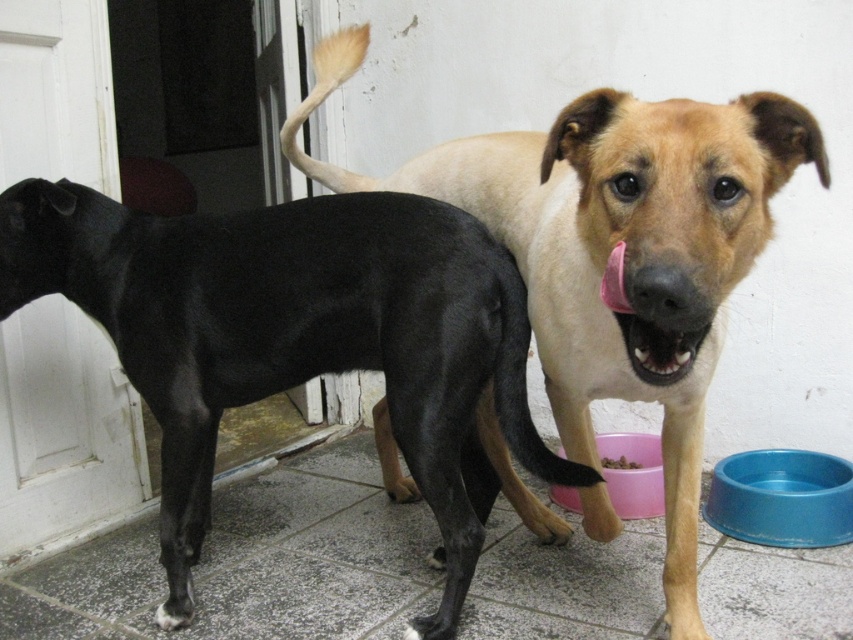
You are a small toy that is 5 inches tall. You want to be seen by the light brown fur dog at center without being stepped on. Where should you position yourself relative to the brown crumbly food at lower center?

The light brown fur dog at center is much taller than the brown crumbly food at lower center, so positioning yourself above the brown crumbly food at lower center would make you visible to the dog without being stepped on.

You are a dog owner who wants to let both dogs outside through the door. The black smooth dog at left is smaller than the light brown fur dog at center. Which dog would need a taller opening in the pet door?

The light brown fur dog at center is taller than the black smooth dog at left, so it would need a taller opening in the pet door.

You are a delivery person trying to enter the house through the white door with a pet door. There is a black smooth dog at left blocking your path. Can you walk through the door without stepping on the dog?

The black smooth dog at left is positioned at point (x=296, y=339), which is not directly in front of the door. Therefore, you can walk through the door without stepping on the dog.